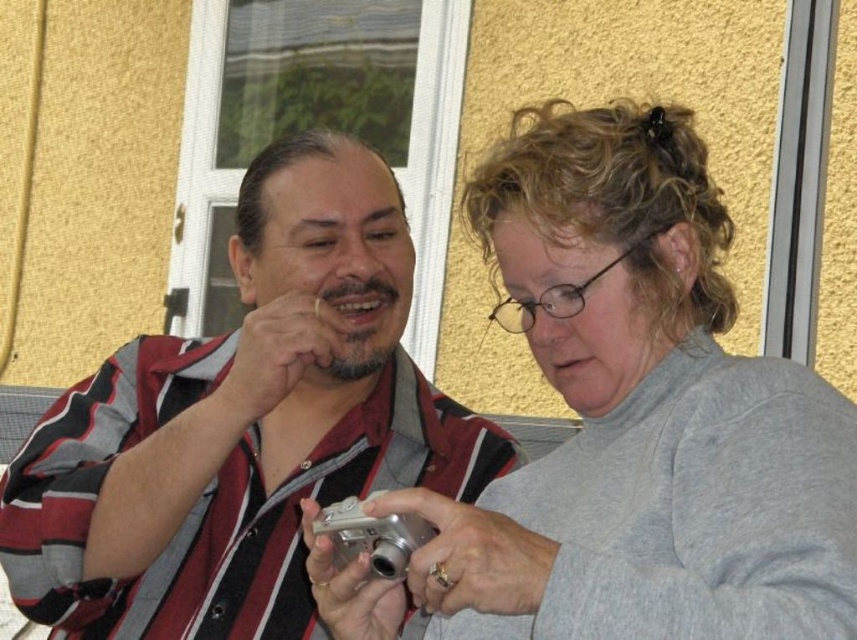
Is gray matte sweater at center thinner than striped fabric shirt at center?

Correct, gray matte sweater at center's width is less than striped fabric shirt at center's.

Is point (586, 550) more distant than point (99, 499)?

That is False.

The height and width of the screenshot is (640, 857). In order to click on gray matte sweater at center in this screenshot , I will do `click(639, 413)`.